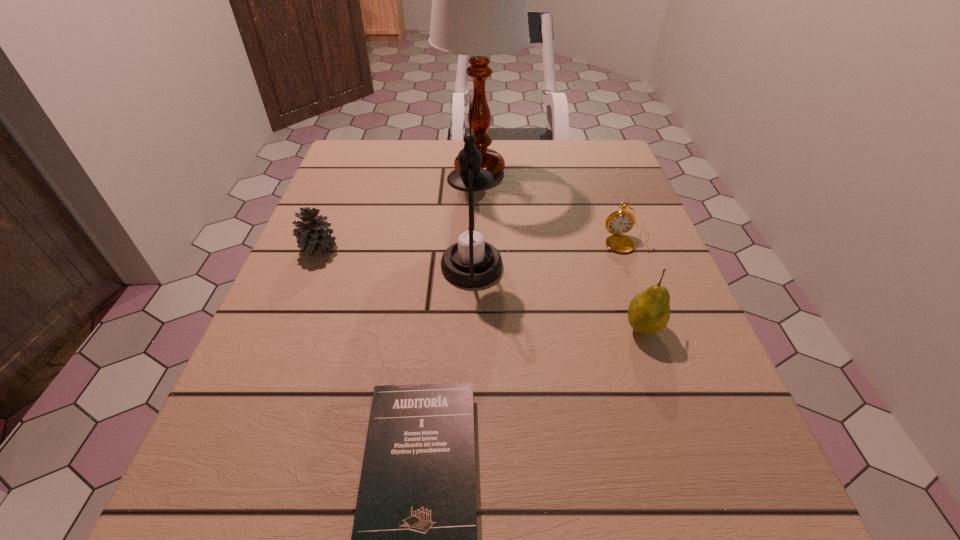
Locate an element on the screen. This screenshot has height=540, width=960. vacant region at the far right corner of the desktop is located at coordinates (618, 161).

Locate an element on the screen. The height and width of the screenshot is (540, 960). free space between the farthest object and the pear is located at coordinates (561, 249).

Find the location of `unoccupied area between the fifth farthest object and the oil lamp`. unoccupied area between the fifth farthest object and the oil lamp is located at coordinates (557, 297).

At what (x,y) coordinates should I click in order to perform the action: click on free space between the tallest object and the pear. Please return your answer as a coordinate pair (x, y). Looking at the image, I should click on point(561,249).

Locate an element on the screen. Image resolution: width=960 pixels, height=540 pixels. vacant space that's between the oil lamp and the pear is located at coordinates (557, 297).

At what (x,y) coordinates should I click in order to perform the action: click on vacant space that is in between the leftmost object and the second nearest object. Please return your answer as a coordinate pair (x, y). Looking at the image, I should click on (481, 288).

Identify the location of vacant area that lies between the oil lamp and the second nearest object. (557, 297).

This screenshot has width=960, height=540. Identify the location of object that is the third closest one to the book. (313, 236).

Locate which object is the second closest to the tallest object. Please provide its 2D coordinates. Your answer should be formatted as a tuple, i.e. [(x, y)], where the tuple contains the x and y coordinates of a point satisfying the conditions above.

[(619, 222)]

This screenshot has height=540, width=960. In order to click on free space that satisfies the following two spatial constraints: 1. on the front side of the pear; 2. on the left side of the fifth shortest object in this screenshot , I will do `click(470, 328)`.